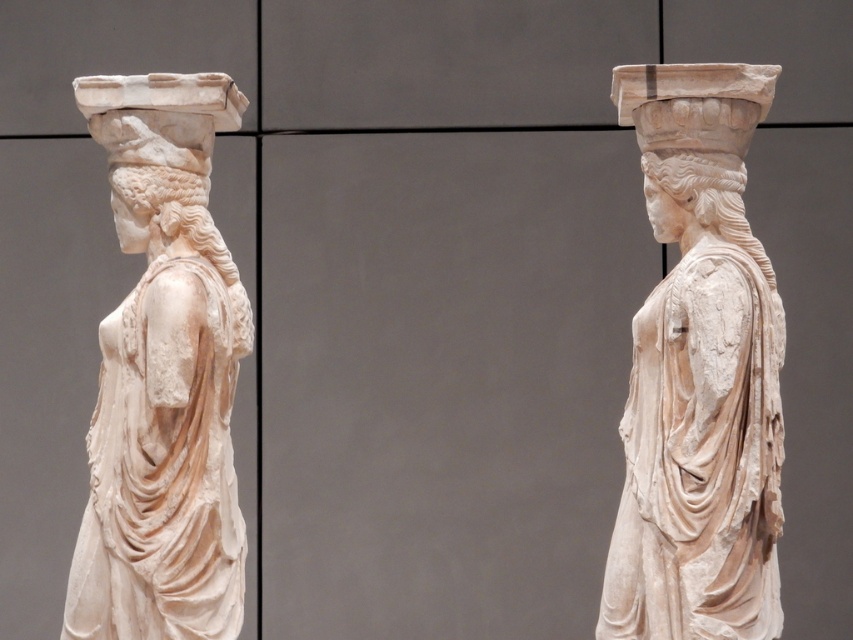
You are an art conservator examining the statues from the front. You notice two points marked on the statues. The first point is at coordinate point (734, 236) and the second is at point (165, 182). Which point is closer to you when viewing the statues from the front?

Point (734, 236) is in front of point (165, 182), so it is closer to you when viewing the statues from the front.

You are an art conservator examining the two white marble statues. Which statue is closer to the viewer, the white marble statue at center or the white marble statue at left?

The white marble statue at center is closer to the viewer as it is positioned in front of the white marble statue at left.

You are an art conservator examining two white marble heads in the image. The white marble head at center and the white marble head at upper left are both part of the statues. Which of these two marble heads is taller?

The white marble head at center is much taller than the white marble head at upper left according to the description provided.